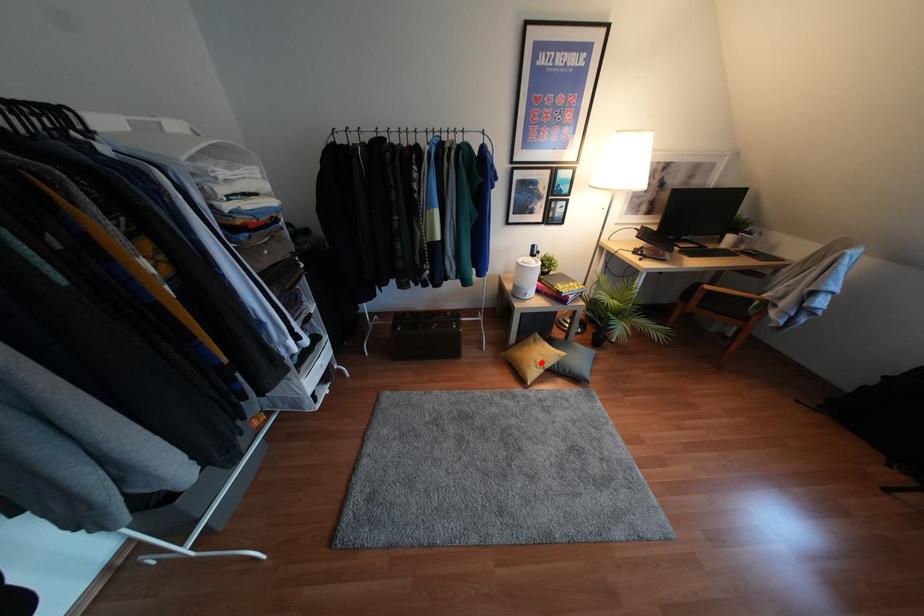
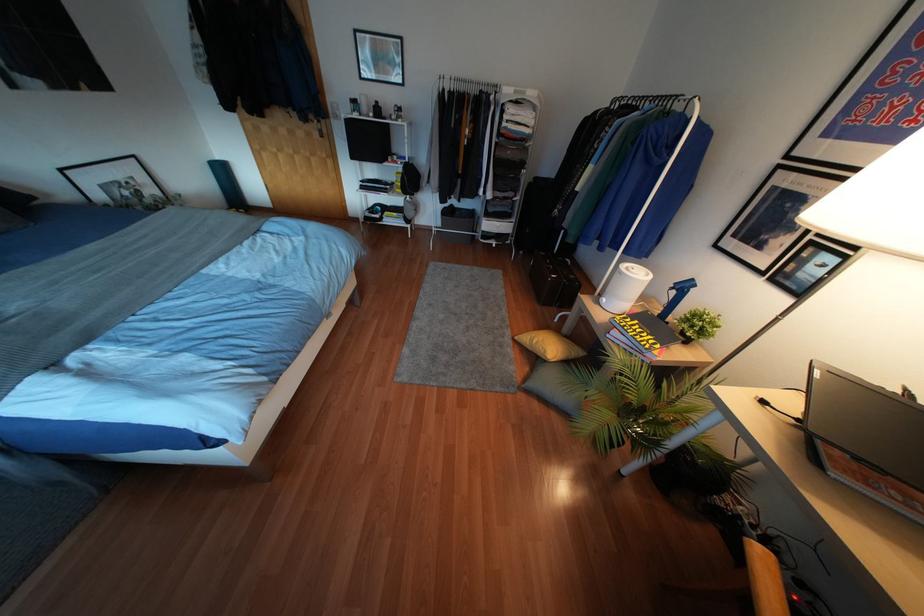
Locate, in the second image, the point that corresponds to the highlighted location in the first image.

(533, 341)